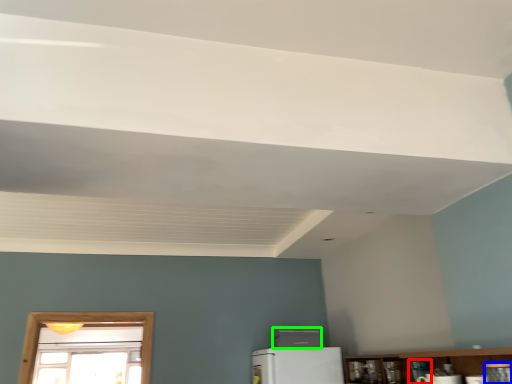
Question: Considering the real-world distances, which object is closest to appliance (highlighted by a red box)? appliance (highlighted by a blue box) or appliance (highlighted by a green box).

Choices:
 (A) appliance
 (B) appliance

Answer: (A)